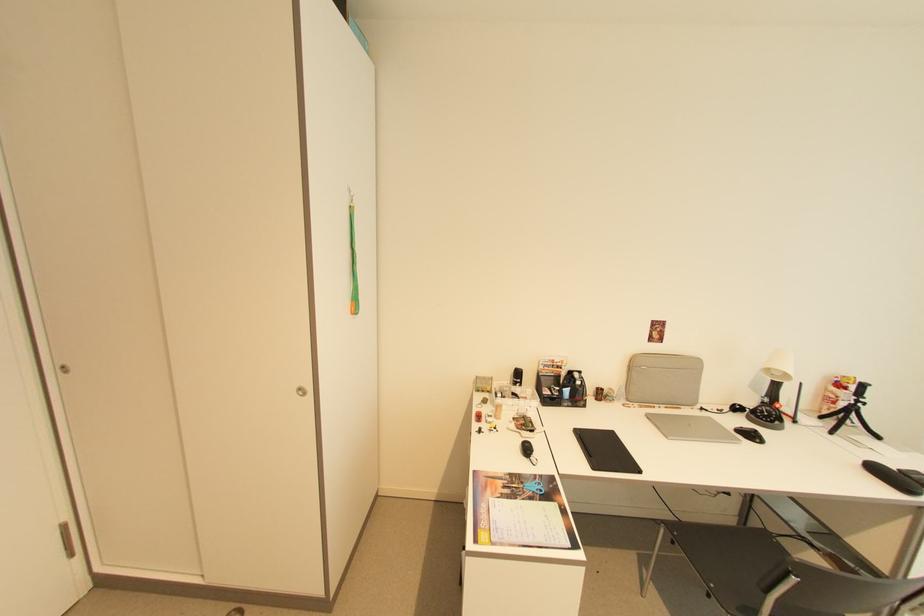
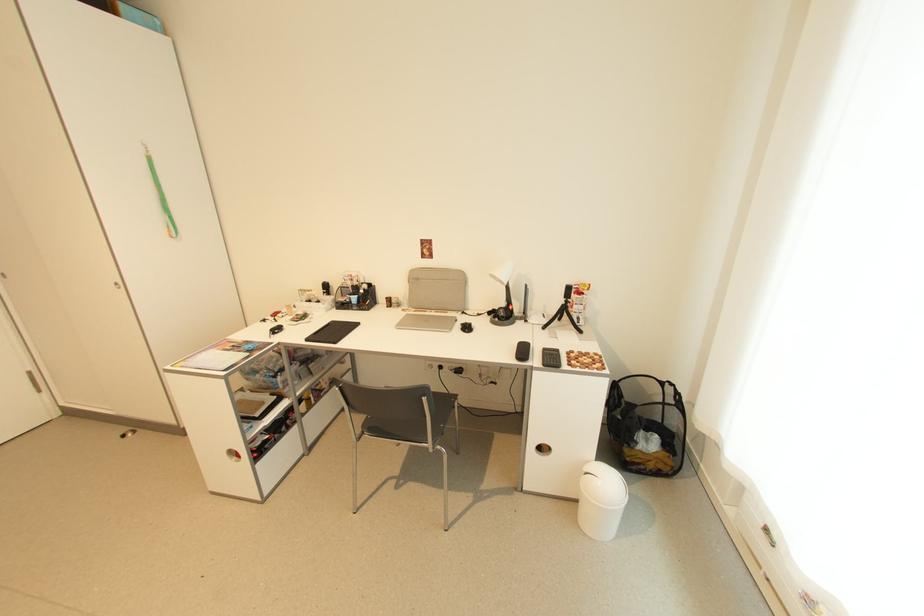
Find the pixel in the second image that matches (x=861, y=403) in the first image.

(572, 302)